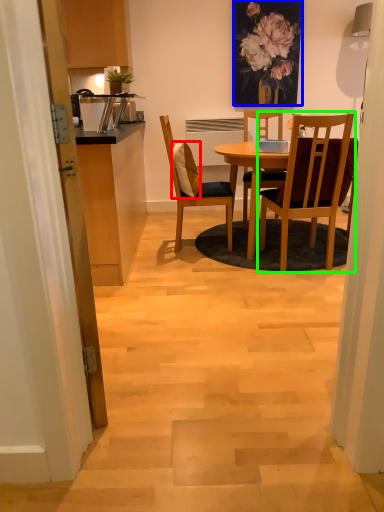
Question: Estimate the real-world distances between objects in this image. Which object is closer to pillow (highlighted by a red box), floral arrangement (highlighted by a blue box) or chair (highlighted by a green box)?

Choices:
 (A) floral arrangement
 (B) chair

Answer: (B)